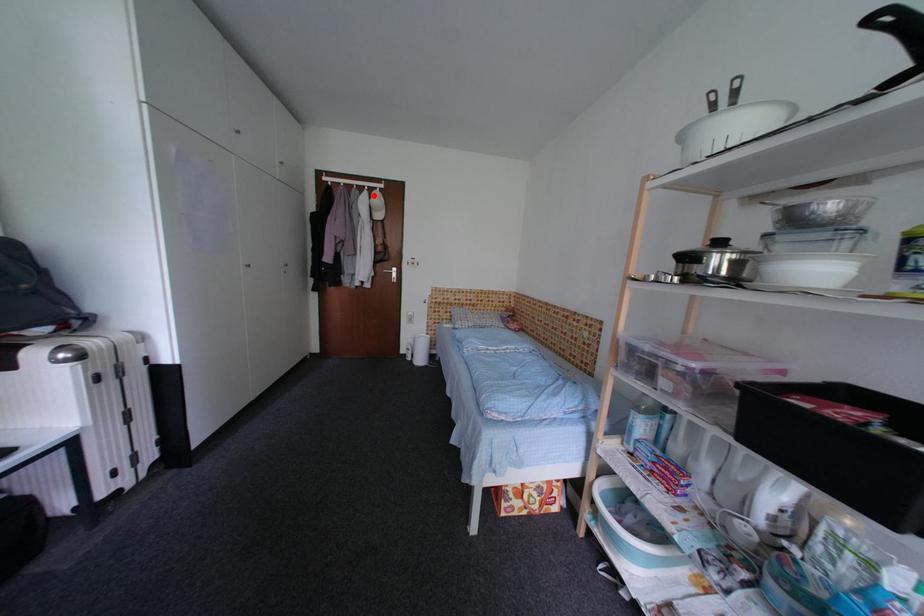
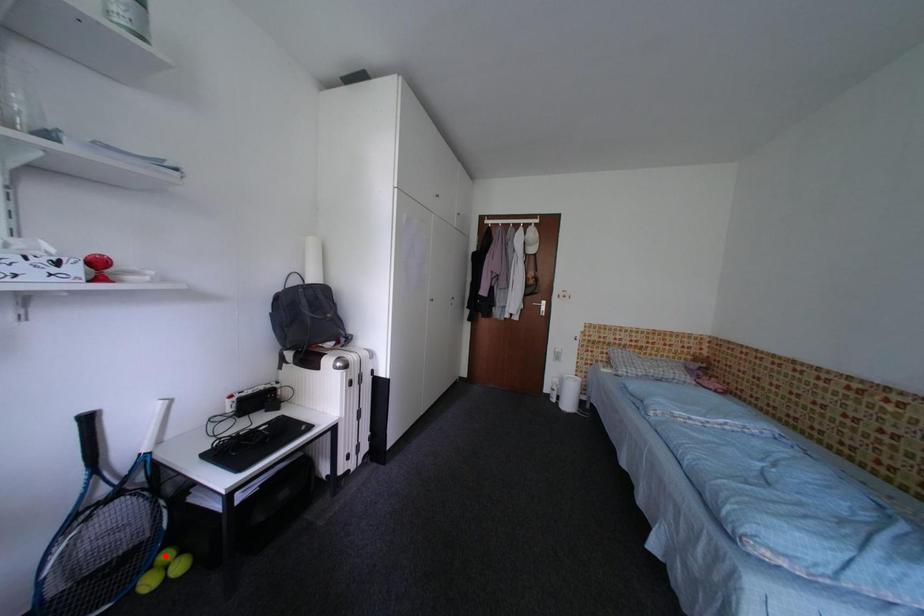
I am providing you with two images of the same scene from different viewpoints. A red point is marked on the first image and another point is marked on the second image. Does the point marked in image1 correspond to the same location as the one in image2?

No